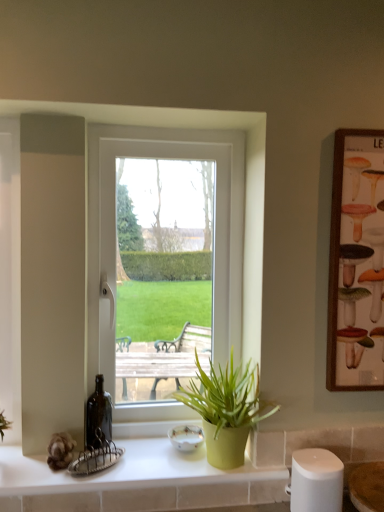
You are a GUI agent. You are given a task and a screenshot of the screen. Output one action in this format:
    pyautogui.click(x=<x>, y=<y>)
    Task: Click on the free spot below green matte pot at lower center (from a real-world perspective)
    The width and height of the screenshot is (384, 512).
    Given the screenshot: What is the action you would take?
    click(x=217, y=472)